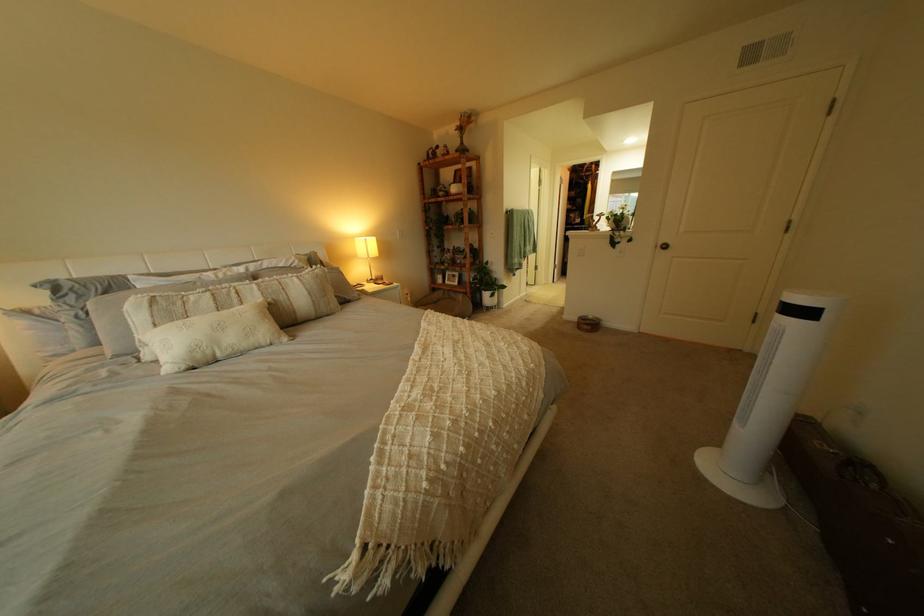
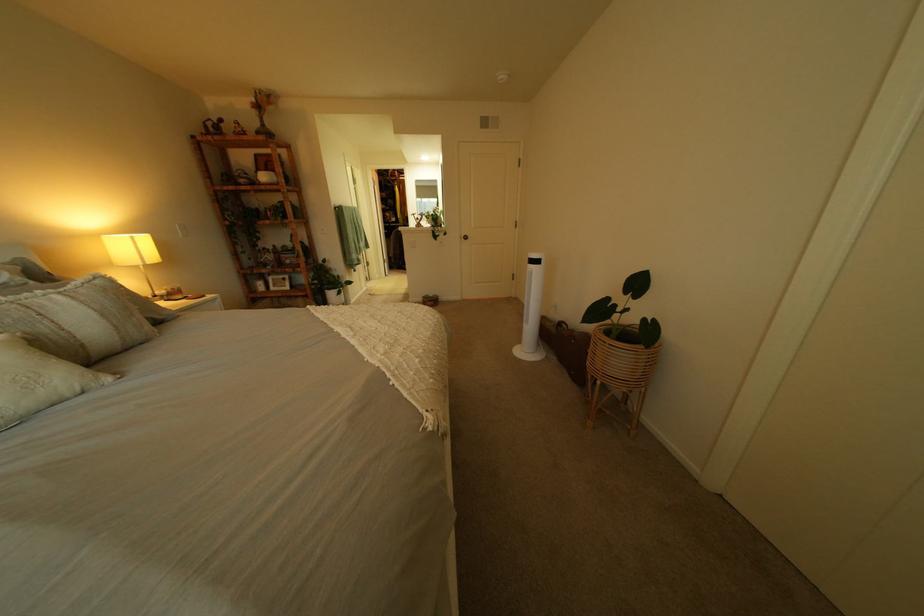
Question: The first image is from the beginning of the video and the second image is from the end. How did the camera likely rotate when shooting the video?

Choices:
 (A) Left
 (B) Right
 (C) Up
 (D) Down

Answer: (B)